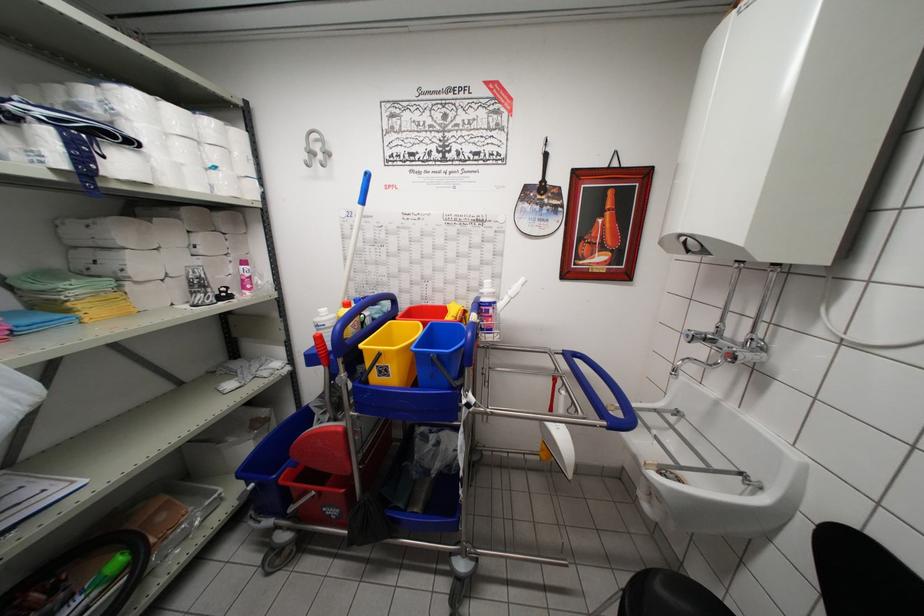
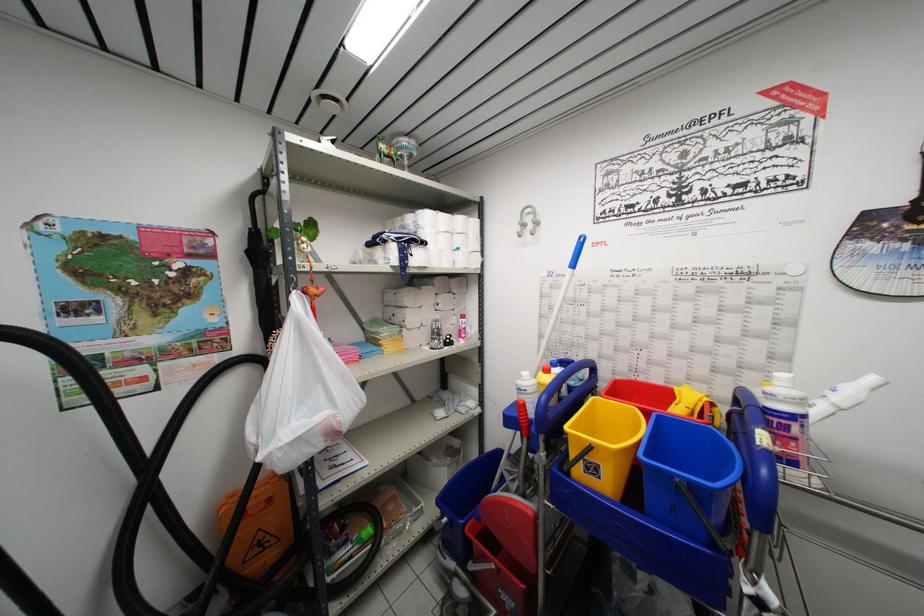
Locate, in the second image, the point that corresponds to pixel 468 315 in the first image.

(715, 408)